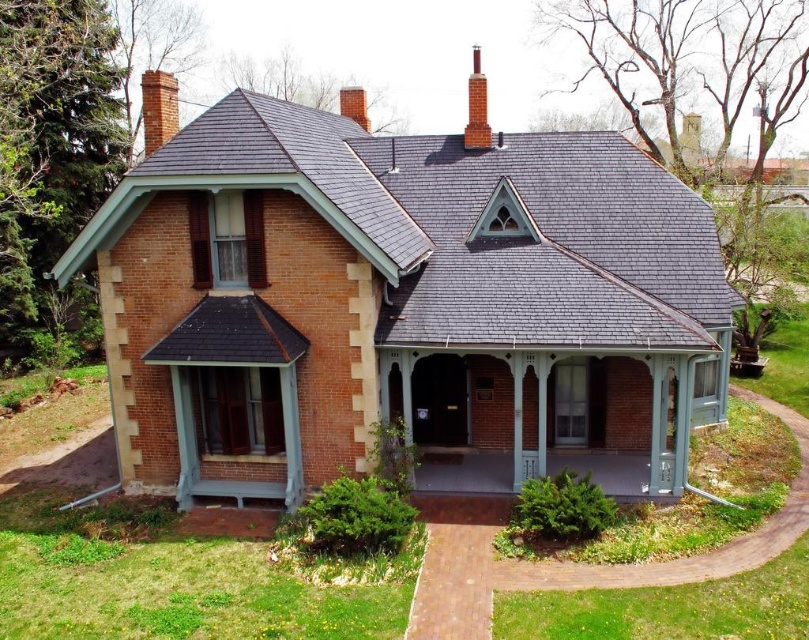
What do you see at coordinates (159, 108) in the screenshot? I see `brick chimney at upper left` at bounding box center [159, 108].

Where is `brick chimney at upper left`? The height and width of the screenshot is (640, 809). brick chimney at upper left is located at coordinates (159, 108).

Is smooth concrete porch at center to the left of red brick chimney at upper center from the viewer's perspective?

Incorrect, smooth concrete porch at center is not on the left side of red brick chimney at upper center.

Does smooth concrete porch at center have a smaller size compared to red brick chimney at upper center?

Indeed, smooth concrete porch at center has a smaller size compared to red brick chimney at upper center.

Image resolution: width=809 pixels, height=640 pixels. What do you see at coordinates (469, 470) in the screenshot?
I see `smooth concrete porch at center` at bounding box center [469, 470].

Locate an element on the screen. This screenshot has width=809, height=640. smooth concrete porch at center is located at coordinates (469, 470).

Which is more to the left, smooth concrete porch at center or brick chimney at upper left?

brick chimney at upper left is more to the left.

Is smooth concrete porch at center closer to camera compared to brick chimney at upper left?

That is True.

This screenshot has width=809, height=640. I want to click on smooth concrete porch at center, so click(469, 470).